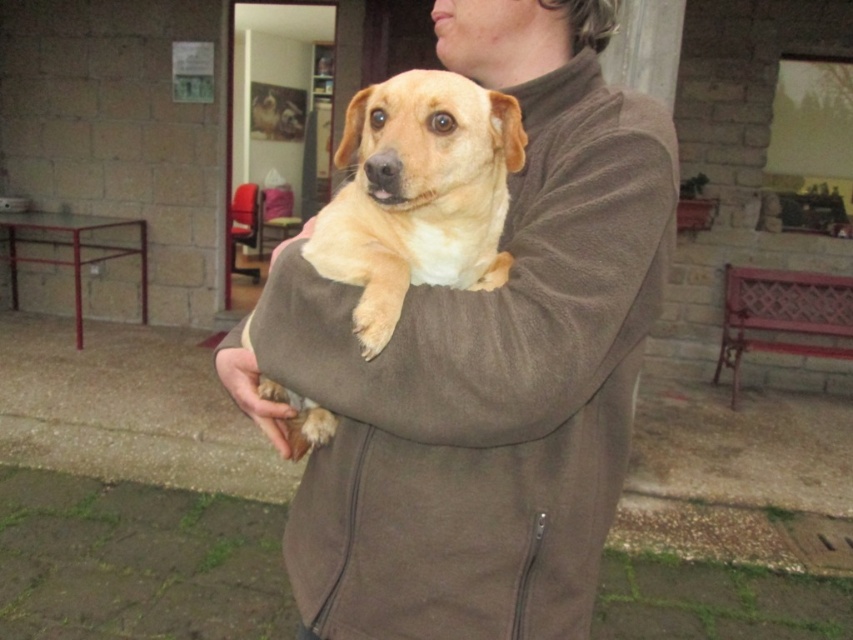
Question: Is matte brown jacket at center positioned in front of light brown fur at center?

Choices:
 (A) yes
 (B) no

Answer: (B)

Question: Among these objects, which one is farthest from the camera?

Choices:
 (A) matte brown jacket at center
 (B) light brown fur at center

Answer: (A)

Question: Can you confirm if matte brown jacket at center is positioned above light brown fur at center?

Choices:
 (A) yes
 (B) no

Answer: (B)

Question: Where is matte brown jacket at center located in relation to light brown fur at center in the image?

Choices:
 (A) right
 (B) left

Answer: (A)